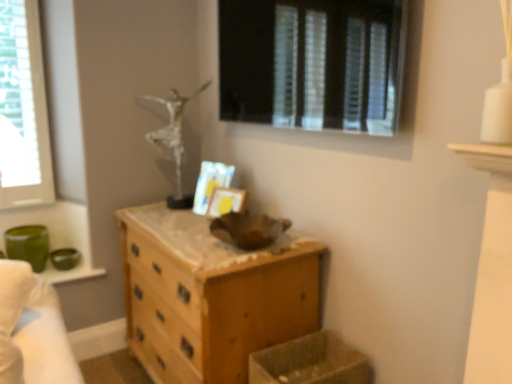
This screenshot has height=384, width=512. What are the coordinates of `free spot to the left of wooden picture frame at center` in the screenshot? It's located at (197, 213).